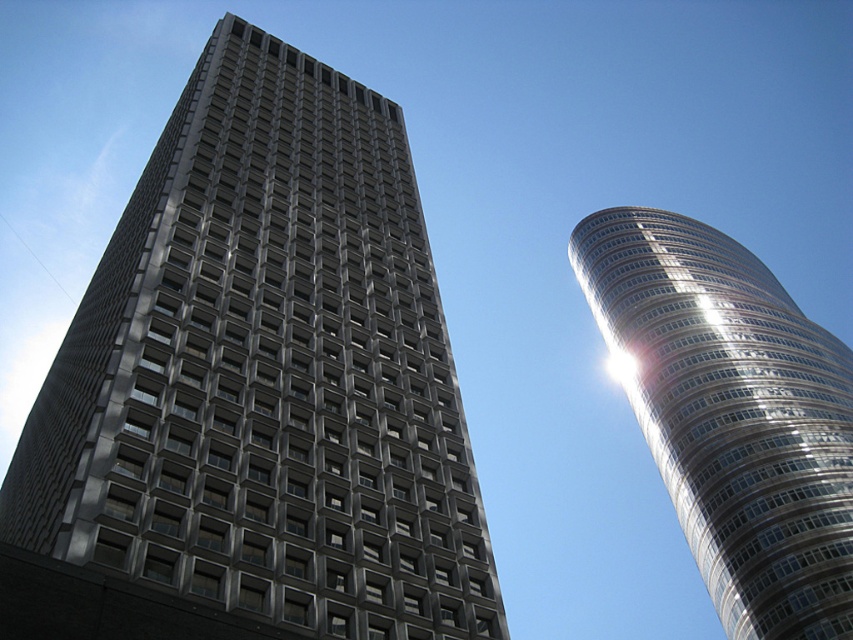
Question: Does matte gray building at center come behind shiny silver tower at right?

Choices:
 (A) no
 (B) yes

Answer: (A)

Question: Which point is farther from the camera taking this photo?

Choices:
 (A) (604, 218)
 (B) (180, 484)

Answer: (A)

Question: Can you confirm if matte gray building at center is thinner than shiny silver tower at right?

Choices:
 (A) yes
 (B) no

Answer: (B)

Question: Which point is farther from the camera taking this photo?

Choices:
 (A) (456, 381)
 (B) (825, 394)

Answer: (B)

Question: Can you confirm if matte gray building at center is bigger than shiny silver tower at right?

Choices:
 (A) no
 (B) yes

Answer: (A)

Question: Which object is farther from the camera taking this photo?

Choices:
 (A) shiny silver tower at right
 (B) matte gray building at center

Answer: (A)